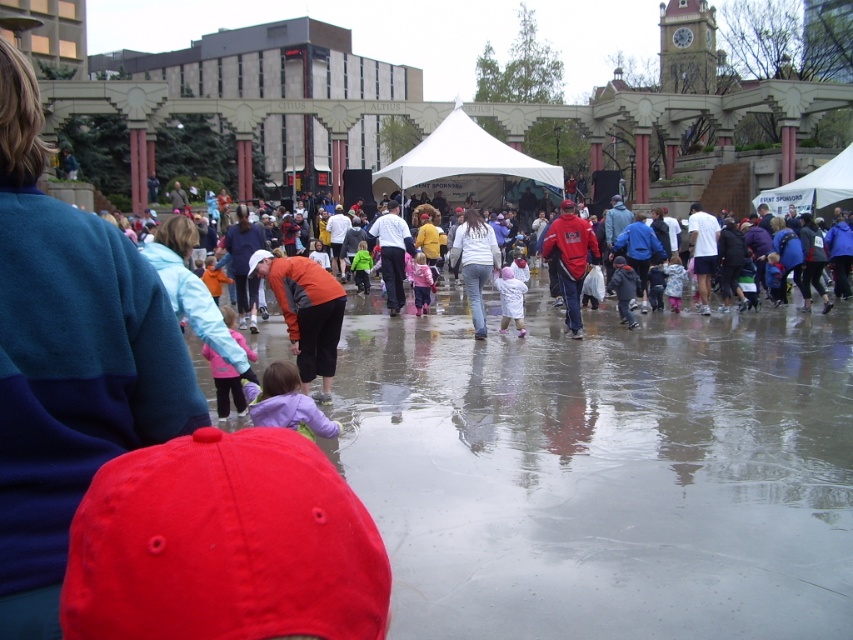
Question: Is purple fleece jacket at center thinner than white matte coat at center?

Choices:
 (A) yes
 (B) no

Answer: (B)

Question: Which object is farther from the camera taking this photo?

Choices:
 (A) purple fleece jacket at center
 (B) white cotton shirt at center
 (C) white fabric tent at center

Answer: (C)

Question: Which point appears closest to the camera in this image?

Choices:
 (A) (265, 403)
 (B) (483, 154)
 (C) (581, 332)
 (D) (781, 272)

Answer: (A)

Question: Is white fabric tent at center above blue denim jacket at lower right?

Choices:
 (A) no
 (B) yes

Answer: (B)

Question: Which object is the farthest from the white matte coat at center?

Choices:
 (A) orange fabric jacket at center
 (B) blue denim jacket at lower right
 (C) purple fleece jacket at center
 (D) red fabric jacket at center

Answer: (C)

Question: Does orange fabric jacket at center have a lesser width compared to red fabric jacket at center?

Choices:
 (A) no
 (B) yes

Answer: (A)